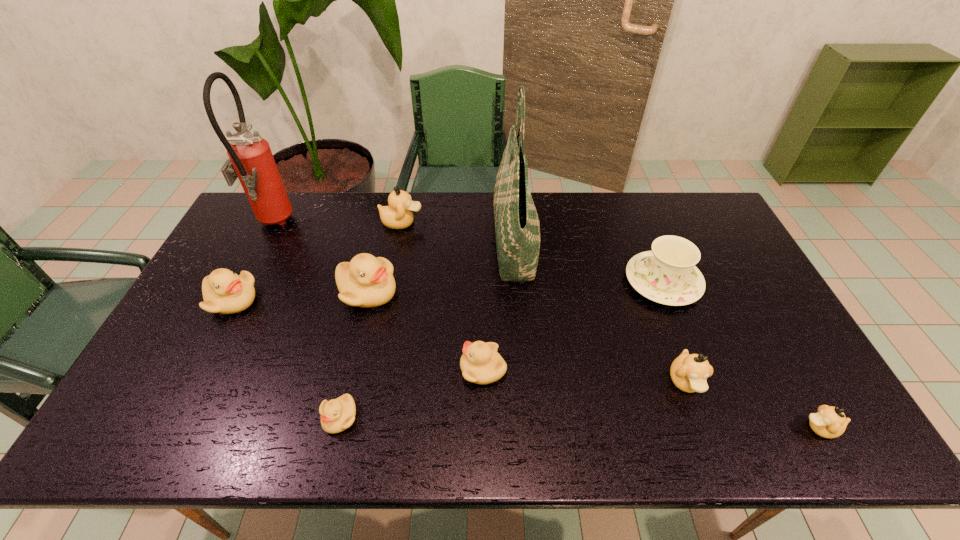
Find the location of `vacant space located 0.290m on the face of the rightmost tan duckling`. vacant space located 0.290m on the face of the rightmost tan duckling is located at coordinates (676, 428).

Locate an element on the screen. tote bag that is at the far edge is located at coordinates (517, 227).

I want to click on fire extinguisher that is at the far edge, so click(251, 160).

In order to click on duckling that is at the far edge in this screenshot , I will do `click(398, 215)`.

At what (x,y) coordinates should I click in order to perform the action: click on fire extinguisher at the left edge. Please return your answer as a coordinate pair (x, y). The height and width of the screenshot is (540, 960). Looking at the image, I should click on (251, 160).

Image resolution: width=960 pixels, height=540 pixels. In order to click on duckling that is at the left edge in this screenshot , I will do `click(225, 292)`.

This screenshot has width=960, height=540. I want to click on object present at the right edge, so click(x=829, y=422).

The image size is (960, 540). Identify the location of object located at the far left corner. (251, 160).

The height and width of the screenshot is (540, 960). I want to click on object positioned at the near right corner, so click(x=829, y=422).

Find the location of a particular element. vacant space at the far edge is located at coordinates (453, 202).